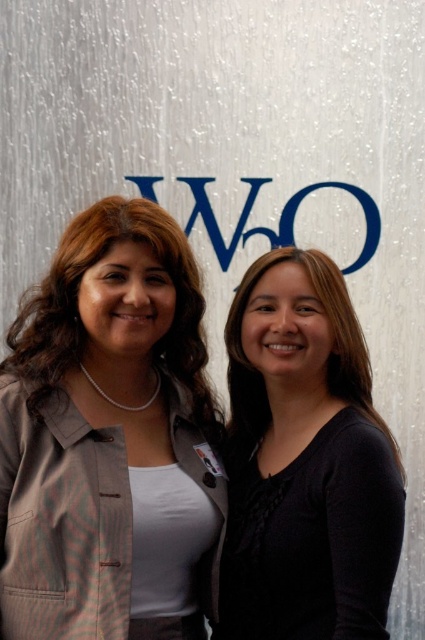
You are standing in front of the image and want to locate the black matte shirt at center. Where is it positioned in terms of horizontal and vertical coordinates?

The black matte shirt at center is positioned at coordinates 0.750 horizontally and 0.725 vertically.

You are taking a photo of two women standing against a backdrop with a WCO logo. You notice two points in the image at coordinates point (283, 444) and point (201, 388). Which point is closer to your camera?

Point (283, 444) is closer to the camera than point (201, 388).

You are a photographer setting up for a group photo. You have a camera with a 12 inch lens. You need to ensure that the black matte shirt at center and the matte brown hair at left are both in focus. Given the distance between them, will your camera be able to capture both subjects clearly in the same shot?

The distance between the black matte shirt at center and the matte brown hair at left is 14.23 inches. Since your camera lens has a 12 inch focal length, it may struggle to keep both objects in focus due to the limited depth of field at such close distances. Consider using a smaller aperture or stepping back to increase the depth of field coverage.